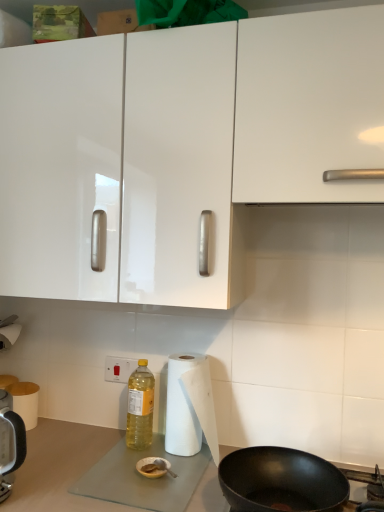
Question: Is white plastic electric outlet at lower center positioned far away from white paper towel at lower left, the 1th paper towel viewed from the back?

Choices:
 (A) no
 (B) yes

Answer: (A)

Question: Considering the relative sizes of white plastic electric outlet at lower center and white paper towel at lower left, which is counted as the first paper towel, starting from the left, in the image provided, is white plastic electric outlet at lower center thinner than white paper towel at lower left, which is counted as the first paper towel, starting from the left,?

Choices:
 (A) no
 (B) yes

Answer: (B)

Question: Is white plastic electric outlet at lower center looking in the opposite direction of white paper towel at lower left, arranged as the 2th paper towel when viewed from the right?

Choices:
 (A) no
 (B) yes

Answer: (A)

Question: Is white plastic electric outlet at lower center located outside white paper towel at lower left, the 1th paper towel viewed from the back?

Choices:
 (A) yes
 (B) no

Answer: (A)

Question: Is white plastic electric outlet at lower center wider than white paper towel at lower left, which is counted as the first paper towel, starting from the left?

Choices:
 (A) no
 (B) yes

Answer: (A)

Question: From the image's perspective, is white plastic electric outlet at lower center beneath white paper towel at lower left, the 2th paper towel in the front-to-back sequence?

Choices:
 (A) yes
 (B) no

Answer: (B)

Question: Is yellow translucent bottle at lower center positioned behind black matte frying pan at lower right?

Choices:
 (A) yes
 (B) no

Answer: (A)

Question: From a real-world perspective, is yellow translucent bottle at lower center located beneath black matte frying pan at lower right?

Choices:
 (A) yes
 (B) no

Answer: (B)

Question: From a real-world perspective, is yellow translucent bottle at lower center located higher than black matte frying pan at lower right?

Choices:
 (A) no
 (B) yes

Answer: (B)

Question: Could you tell me if yellow translucent bottle at lower center is turned towards black matte frying pan at lower right?

Choices:
 (A) no
 (B) yes

Answer: (A)

Question: Can you confirm if yellow translucent bottle at lower center is positioned to the right of black matte frying pan at lower right?

Choices:
 (A) yes
 (B) no

Answer: (B)

Question: Would you say yellow translucent bottle at lower center is outside black matte frying pan at lower right?

Choices:
 (A) no
 (B) yes

Answer: (B)

Question: Does yellow translucent bottle at lower center have a greater height compared to white paper towel at lower left, which is counted as the first paper towel, starting from the left?

Choices:
 (A) no
 (B) yes

Answer: (B)